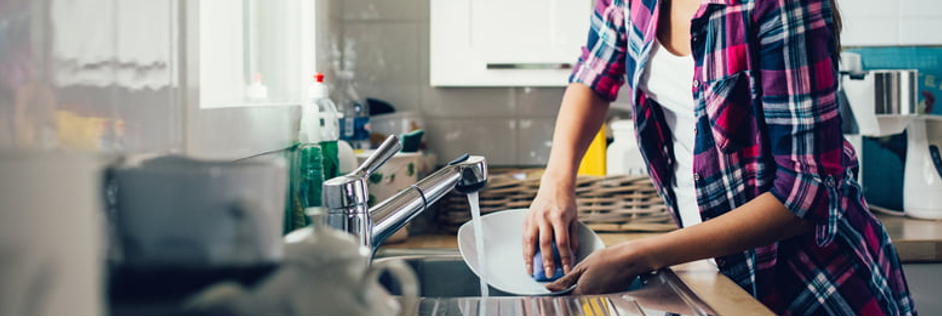
Locate an element on the screen. The width and height of the screenshot is (942, 319). white plate is located at coordinates (507, 250).